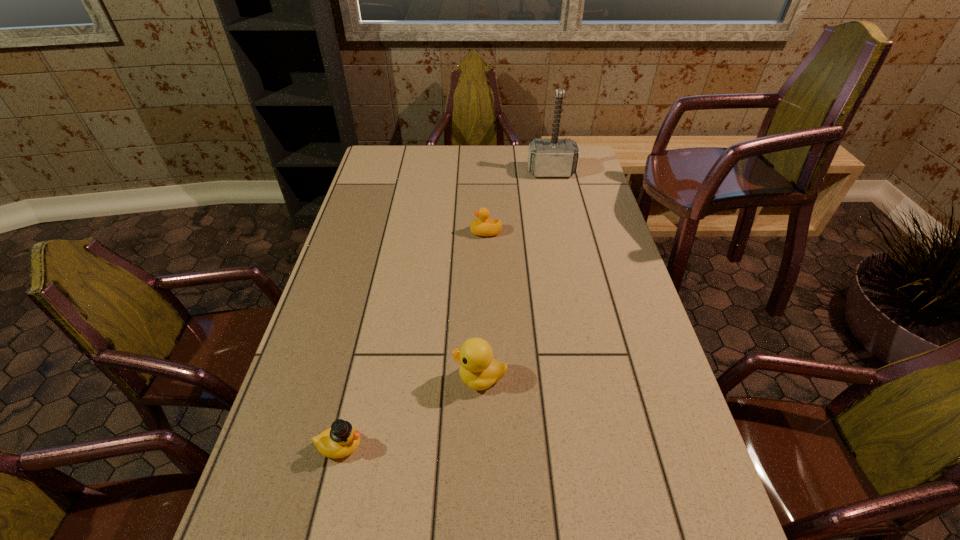
In the image, there is a desktop. At what (x,y) coordinates should I click in order to perform the action: click on vacant area at the left edge. Please return your answer as a coordinate pair (x, y). This screenshot has height=540, width=960. Looking at the image, I should click on (383, 227).

Image resolution: width=960 pixels, height=540 pixels. Identify the location of vacant space at the right edge. (573, 210).

The height and width of the screenshot is (540, 960). I want to click on vacant area between the leftmost duck and the tallest object, so click(445, 309).

Where is `free space between the farthest duck and the farthest object`? free space between the farthest duck and the farthest object is located at coordinates (518, 202).

Where is `free spot between the tallest object and the nearest object`? This screenshot has width=960, height=540. free spot between the tallest object and the nearest object is located at coordinates (445, 309).

At what (x,y) coordinates should I click in order to perform the action: click on free area in between the nearest duck and the second farthest object. Please return your answer as a coordinate pair (x, y). This screenshot has width=960, height=540. Looking at the image, I should click on (413, 339).

The image size is (960, 540). What are the coordinates of `free space between the farthest duck and the tallest object` in the screenshot? It's located at (518, 202).

Identify the location of free space between the hammer and the leftmost object. The image size is (960, 540). (445, 309).

Find the location of a particular element. This screenshot has width=960, height=540. empty space that is in between the second farthest duck and the farthest duck is located at coordinates 483,305.

You are a GUI agent. You are given a task and a screenshot of the screen. Output one action in this format:
    pyautogui.click(x=<x>, y=<y>)
    Task: Click on the vacant space that is in between the tallest object and the second nearest duck
    
    Given the screenshot: What is the action you would take?
    pyautogui.click(x=516, y=275)